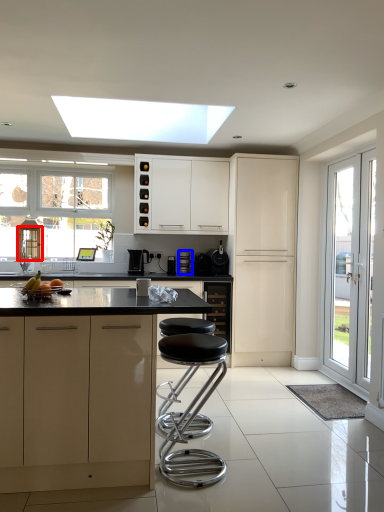
Question: Among these objects, which one is nearest to the camera, door (highlighted by a red box) or appliance (highlighted by a blue box)?

Choices:
 (A) door
 (B) appliance

Answer: (A)